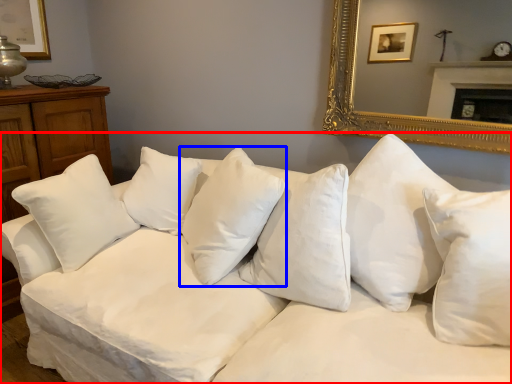
Question: Which point is closer to the camera, studio couch (highlighted by a red box) or pillow (highlighted by a blue box)?

Choices:
 (A) studio couch
 (B) pillow

Answer: (A)